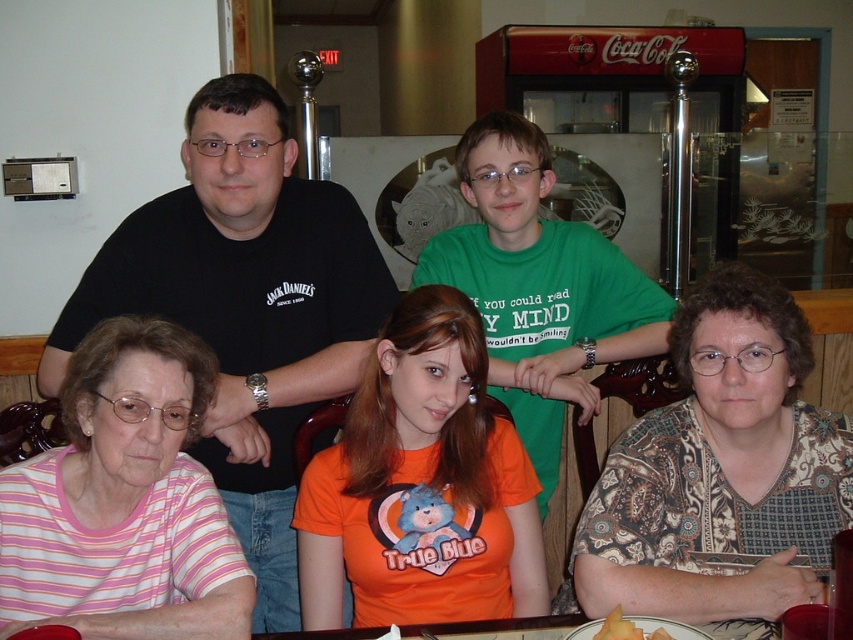
Who is positioned more to the right, black t-shirt at upper center or floral-patterned blouse at lower right?

floral-patterned blouse at lower right

Between point (223, 480) and point (688, 408), which one is positioned in front?

Point (688, 408)

The width and height of the screenshot is (853, 640). I want to click on black t-shirt at upper center, so click(x=245, y=307).

Is black t-shirt at upper center below green cotton shirt at center?

Yes.

Consider the image. Which is below, black t-shirt at upper center or green cotton shirt at center?

black t-shirt at upper center is below.

Describe the element at coordinates (245, 307) in the screenshot. This screenshot has width=853, height=640. I see `black t-shirt at upper center` at that location.

I want to click on black t-shirt at upper center, so click(245, 307).

Is orange matte shirt at center taller than yellow matte melon at lower center?

Indeed, orange matte shirt at center has a greater height compared to yellow matte melon at lower center.

Does point (463, 307) come farther from viewer compared to point (606, 634)?

That is True.

Where is `orange matte shirt at center`? This screenshot has width=853, height=640. orange matte shirt at center is located at coordinates (421, 486).

Where is `orange matte shirt at center`? This screenshot has width=853, height=640. orange matte shirt at center is located at coordinates (421, 486).